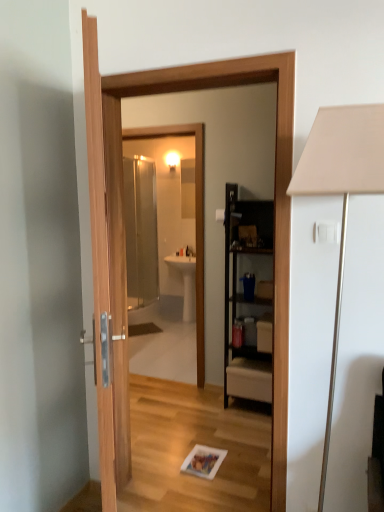
The width and height of the screenshot is (384, 512). Describe the element at coordinates (186, 279) in the screenshot. I see `white glossy sink at center` at that location.

The height and width of the screenshot is (512, 384). What do you see at coordinates (196, 217) in the screenshot? I see `transparent glass mirror at center` at bounding box center [196, 217].

Find the location of a particular element. The width and height of the screenshot is (384, 512). wooden door at center is located at coordinates (274, 197).

From a real-world perspective, is white glossy sink at center over white matte table lamp at right?

Incorrect, from a real-world perspective, white glossy sink at center is lower than white matte table lamp at right.

Considering the relative sizes of white glossy sink at center and white matte table lamp at right in the image provided, is white glossy sink at center taller than white matte table lamp at right?

Incorrect, the height of white glossy sink at center is not larger of that of white matte table lamp at right.

Does white glossy sink at center have a smaller size compared to white matte table lamp at right?

Yes.

Which is more to the right, white glossy sink at center or white matte table lamp at right?

white matte table lamp at right is more to the right.

Between point (332, 358) and point (192, 275), which one is positioned in front?

The point (332, 358) is in front.

Is white matte table lamp at right aimed at white glossy sink at center?

No.

Considering the sizes of objects white matte table lamp at right and white glossy sink at center in the image provided, who is wider, white matte table lamp at right or white glossy sink at center?

Wider between the two is white matte table lamp at right.

Identify the location of cabinetry on the right of white glossy sink at center. (248, 298).

Which object is positioned more to the right, white glossy sink at center or black wood cabinet at center?

Positioned to the right is black wood cabinet at center.

Is white glossy sink at center smaller than black wood cabinet at center?

Yes.

Can you confirm if white glossy sink at center is wider than black wood cabinet at center?

Indeed, white glossy sink at center has a greater width compared to black wood cabinet at center.

Which of these two, transparent glass mirror at center or wooden door at center, stands shorter?

transparent glass mirror at center.

At what (x,y) coordinates should I click in order to perform the action: click on mirror that appears below the wooden door at center (from a real-world perspective). Please return your answer as a coordinate pair (x, y). Looking at the image, I should click on (196, 217).

Can you confirm if transparent glass mirror at center is thinner than wooden door at center?

Yes, transparent glass mirror at center is thinner than wooden door at center.

In the scene shown: Which is more to the right, transparent glass mirror at center or wooden door at center?

Positioned to the right is wooden door at center.

Choose the correct answer: Is wooden door at center inside transparent glass mirror at center or outside it?

wooden door at center is not inside transparent glass mirror at center, it's outside.

Is wooden door at center facing towards transparent glass mirror at center?

No, wooden door at center is not turned towards transparent glass mirror at center.

Considering the sizes of wooden door at center and transparent glass mirror at center in the image, is wooden door at center bigger or smaller than transparent glass mirror at center?

Clearly, wooden door at center is larger in size than transparent glass mirror at center.

Considering the positions of objects transparent glass mirror at center and white glossy sink at center in the image provided, who is more to the left, transparent glass mirror at center or white glossy sink at center?

Positioned to the left is transparent glass mirror at center.

Is transparent glass mirror at center aimed at white glossy sink at center?

No, transparent glass mirror at center is not facing towards white glossy sink at center.

Identify the location of mirror on the left of white glossy sink at center. The image size is (384, 512). (196, 217).

Is point (176, 134) positioned before point (192, 267)?

Yes, point (176, 134) is in front of point (192, 267).

In the image, is wooden door at center positioned in front of or behind black wood cabinet at center?

Visually, wooden door at center is located in front of black wood cabinet at center.

Between wooden door at center and black wood cabinet at center, which one has less height?

Standing shorter between the two is black wood cabinet at center.

Find the location of `screen door located above the black wood cabinet at center (from the image's perspective)`. screen door located above the black wood cabinet at center (from the image's perspective) is located at coordinates (274, 197).

You are a GUI agent. You are given a task and a screenshot of the screen. Output one action in this format:
    pyautogui.click(x=<x>, y=<y>)
    Task: Click on the sink that is on the left side of white matte table lamp at right
    
    Given the screenshot: What is the action you would take?
    pyautogui.click(x=186, y=279)

You are a GUI agent. You are given a task and a screenshot of the screen. Output one action in this format:
    pyautogui.click(x=<x>, y=<y>)
    Task: Click on the sink below the white matte table lamp at right (from a real-world perspective)
    
    Given the screenshot: What is the action you would take?
    pyautogui.click(x=186, y=279)

Considering their positions, is transparent glass mirror at center positioned further to black wood cabinet at center than white matte table lamp at right?

white matte table lamp at right lies further to black wood cabinet at center than the other object.

Looking at the image, which one is located closer to black wood cabinet at center, transparent glass mirror at center or white glossy sink at center?

transparent glass mirror at center is positioned closer to the anchor black wood cabinet at center.

Based on their spatial positions, is black wood cabinet at center or wooden door at center closer to white glossy sink at center?

black wood cabinet at center is closer to white glossy sink at center.

Looking at the image, which one is located closer to black wood cabinet at center, white matte table lamp at right or wooden door at center?

wooden door at center is closer to black wood cabinet at center.

In the scene shown: Considering their positions, is black wood cabinet at center positioned further to transparent glass mirror at center than white matte table lamp at right?

Based on the image, white matte table lamp at right appears to be further to transparent glass mirror at center.

Looking at the image, which one is located further to transparent glass mirror at center, white matte table lamp at right or white glossy sink at center?

white matte table lamp at right is further to transparent glass mirror at center.

Which object lies further to the anchor point wooden door at center, white glossy sink at center or transparent glass mirror at center?

white glossy sink at center is positioned further to the anchor wooden door at center.

When comparing their distances from transparent glass mirror at center, does white matte table lamp at right or black wood cabinet at center seem further?

Based on the image, white matte table lamp at right appears to be further to transparent glass mirror at center.

Where is `cabinetry between wooden door at center and white glossy sink at center along the z-axis`? The image size is (384, 512). cabinetry between wooden door at center and white glossy sink at center along the z-axis is located at coordinates (248, 298).

Where is `cabinetry between white matte table lamp at right and white glossy sink at center in the front-back direction`? cabinetry between white matte table lamp at right and white glossy sink at center in the front-back direction is located at coordinates (248, 298).

You are a GUI agent. You are given a task and a screenshot of the screen. Output one action in this format:
    pyautogui.click(x=<x>, y=<y>)
    Task: Click on the cabinetry between wooden door at center and transparent glass mirror at center in the front-back direction
    The width and height of the screenshot is (384, 512).
    Given the screenshot: What is the action you would take?
    pyautogui.click(x=248, y=298)

Find the location of `screen door between white matte table lamp at right and transparent glass mirror at center in the front-back direction`. screen door between white matte table lamp at right and transparent glass mirror at center in the front-back direction is located at coordinates (274, 197).